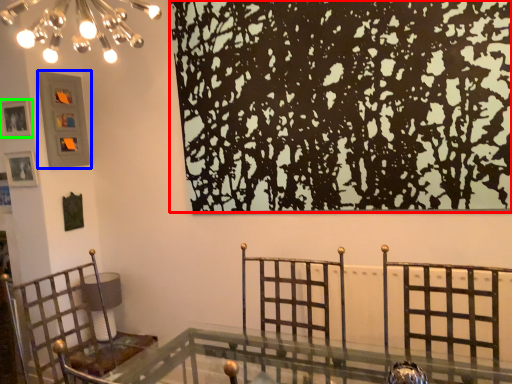
Question: Considering the real-world distances, which object is farthest from tree (highlighted by a red box)? picture frame (highlighted by a blue box) or picture frame (highlighted by a green box)?

Choices:
 (A) picture frame
 (B) picture frame

Answer: (B)